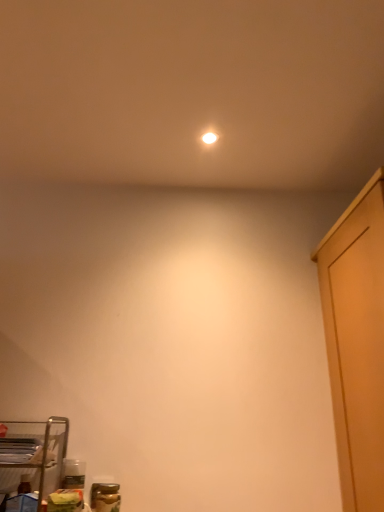
Measure the distance between metal wire rack at lower left and camera.

metal wire rack at lower left and camera are 4.80 feet apart from each other.

Locate an element on the screen. This screenshot has width=384, height=512. metal wire rack at lower left is located at coordinates (32, 455).

This screenshot has width=384, height=512. What do you see at coordinates (32, 455) in the screenshot?
I see `metal wire rack at lower left` at bounding box center [32, 455].

The height and width of the screenshot is (512, 384). I want to click on white glossy light bulb at upper center, so click(209, 138).

What do you see at coordinates (209, 138) in the screenshot?
I see `white glossy light bulb at upper center` at bounding box center [209, 138].

You are a GUI agent. You are given a task and a screenshot of the screen. Output one action in this format:
    pyautogui.click(x=<x>, y=<y>)
    Task: Click on the metal wire rack at lower left
    This screenshot has height=512, width=384.
    Given the screenshot: What is the action you would take?
    click(32, 455)

Which object is positioned more to the left, metal wire rack at lower left or white glossy light bulb at upper center?

metal wire rack at lower left.

Who is more distant, metal wire rack at lower left or white glossy light bulb at upper center?

white glossy light bulb at upper center is more distant.

Between point (56, 431) and point (212, 137), which one is positioned in front?

The point (56, 431) is closer.

From the image's perspective, which one is positioned higher, metal wire rack at lower left or white glossy light bulb at upper center?

white glossy light bulb at upper center is shown above in the image.

From a real-world perspective, which object rests below the other?

metal wire rack at lower left.

Considering the sizes of metal wire rack at lower left and white glossy light bulb at upper center in the image, is metal wire rack at lower left wider or thinner than white glossy light bulb at upper center?

Considering their sizes, metal wire rack at lower left looks broader than white glossy light bulb at upper center.

Consider the image. Considering the sizes of objects metal wire rack at lower left and white glossy light bulb at upper center in the image provided, who is shorter, metal wire rack at lower left or white glossy light bulb at upper center?

white glossy light bulb at upper center is shorter.

Looking at the image, does metal wire rack at lower left seem bigger or smaller compared to white glossy light bulb at upper center?

Considering their sizes, metal wire rack at lower left takes up more space than white glossy light bulb at upper center.

Is metal wire rack at lower left inside or outside of white glossy light bulb at upper center?

metal wire rack at lower left is not inside white glossy light bulb at upper center, it's outside.

Based on the photo, is there a large distance between metal wire rack at lower left and white glossy light bulb at upper center?

Yes.

Is metal wire rack at lower left looking in the opposite direction of white glossy light bulb at upper center?

No, metal wire rack at lower left's orientation is not away from white glossy light bulb at upper center.

How much distance is there between metal wire rack at lower left and white glossy light bulb at upper center?

They are 1.39 meters apart.

This screenshot has width=384, height=512. Identify the location of furniture beneath the white glossy light bulb at upper center (from a real-world perspective). (32, 455).

Considering the positions of objects white glossy light bulb at upper center and metal wire rack at lower left in the image provided, who is more to the right, white glossy light bulb at upper center or metal wire rack at lower left?

Positioned to the right is white glossy light bulb at upper center.

Which object is more forward, white glossy light bulb at upper center or metal wire rack at lower left?

metal wire rack at lower left is more forward.

Between point (206, 136) and point (64, 422), which one is positioned behind?

Positioned behind is point (206, 136).

From the image's perspective, would you say white glossy light bulb at upper center is shown under metal wire rack at lower left?

Incorrect, from the image's perspective, white glossy light bulb at upper center is higher than metal wire rack at lower left.

From a real-world perspective, is white glossy light bulb at upper center below metal wire rack at lower left?

No.

Considering the sizes of objects white glossy light bulb at upper center and metal wire rack at lower left in the image provided, who is thinner, white glossy light bulb at upper center or metal wire rack at lower left?

white glossy light bulb at upper center is thinner.

Considering the relative sizes of white glossy light bulb at upper center and metal wire rack at lower left in the image provided, is white glossy light bulb at upper center shorter than metal wire rack at lower left?

Yes, white glossy light bulb at upper center is shorter than metal wire rack at lower left.

Is white glossy light bulb at upper center bigger or smaller than metal wire rack at lower left?

In the image, white glossy light bulb at upper center appears to be smaller than metal wire rack at lower left.

Is white glossy light bulb at upper center not inside metal wire rack at lower left?

Yes, white glossy light bulb at upper center is not within metal wire rack at lower left.

Is white glossy light bulb at upper center next to metal wire rack at lower left and touching it?

white glossy light bulb at upper center and metal wire rack at lower left are clearly separated.

Is white glossy light bulb at upper center facing towards metal wire rack at lower left?

No, white glossy light bulb at upper center is not facing towards metal wire rack at lower left.

This screenshot has width=384, height=512. Find the location of `furniture on the left of white glossy light bulb at upper center`. furniture on the left of white glossy light bulb at upper center is located at coordinates (32, 455).

Find the location of `furniture below the white glossy light bulb at upper center (from a real-world perspective)`. furniture below the white glossy light bulb at upper center (from a real-world perspective) is located at coordinates (32, 455).

Locate an element on the screen. This screenshot has height=512, width=384. lighting above the metal wire rack at lower left (from a real-world perspective) is located at coordinates (209, 138).